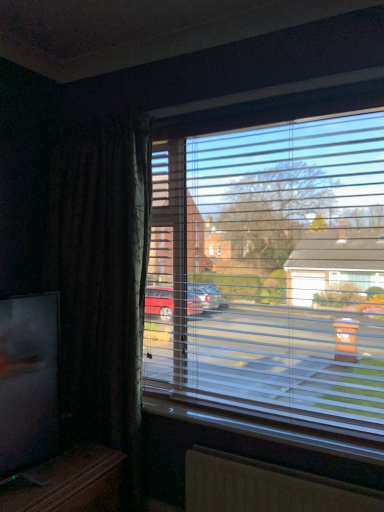
Question: From the image's perspective, is white plastic window sill at lower center located above or below brown textured radiator at lower center?

Choices:
 (A) above
 (B) below

Answer: (A)

Question: Is white plastic window sill at lower center bigger or smaller than brown textured radiator at lower center?

Choices:
 (A) small
 (B) big

Answer: (A)

Question: Estimate the real-world distances between objects in this image. Which object is farther from the white plastic window sill at lower center?

Choices:
 (A) transparent plastic blinds at center
 (B) brown textured radiator at lower center
 (C) matte black tv at lower left

Answer: (C)

Question: Estimate the real-world distances between objects in this image. Which object is farther from the transparent plastic blinds at center?

Choices:
 (A) matte black tv at lower left
 (B) white plastic window sill at lower center
 (C) brown textured radiator at lower center

Answer: (A)